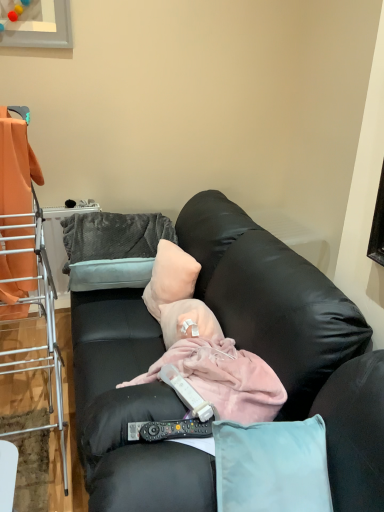
Question: Is orange fabric at left beside black leather couch at center?

Choices:
 (A) no
 (B) yes

Answer: (A)

Question: Is black leather couch at center surrounded by orange fabric at left?

Choices:
 (A) no
 (B) yes

Answer: (A)

Question: Is orange fabric at left positioned far away from black leather couch at center?

Choices:
 (A) no
 (B) yes

Answer: (A)

Question: From a real-world perspective, is orange fabric at left located beneath black leather couch at center?

Choices:
 (A) yes
 (B) no

Answer: (B)

Question: Can you confirm if orange fabric at left is thinner than black leather couch at center?

Choices:
 (A) yes
 (B) no

Answer: (A)

Question: Is orange fabric at left not within black leather couch at center?

Choices:
 (A) yes
 (B) no

Answer: (A)

Question: From a real-world perspective, is orange fabric at left physically below pale pink fabric pillow at center, acting as the 2th pillow starting from the left?

Choices:
 (A) yes
 (B) no

Answer: (B)

Question: From a real-world perspective, is orange fabric at left on top of pale pink fabric pillow at center, the 1th pillow from the right?

Choices:
 (A) no
 (B) yes

Answer: (B)

Question: From the image's perspective, is orange fabric at left located above pale pink fabric pillow at center, acting as the 2th pillow starting from the left?

Choices:
 (A) no
 (B) yes

Answer: (B)

Question: Can you confirm if orange fabric at left is positioned to the right of pale pink fabric pillow at center, the 1th pillow from the right?

Choices:
 (A) no
 (B) yes

Answer: (A)

Question: Is orange fabric at left bigger than pale pink fabric pillow at center, the 1th pillow from the right?

Choices:
 (A) no
 (B) yes

Answer: (B)

Question: Is orange fabric at left facing away from pale pink fabric pillow at center, acting as the 2th pillow starting from the left?

Choices:
 (A) no
 (B) yes

Answer: (B)

Question: From the image's perspective, is orange fabric at left located above gray plush pillow at upper left, which ranks as the 1th pillow in left-to-right order?

Choices:
 (A) yes
 (B) no

Answer: (B)